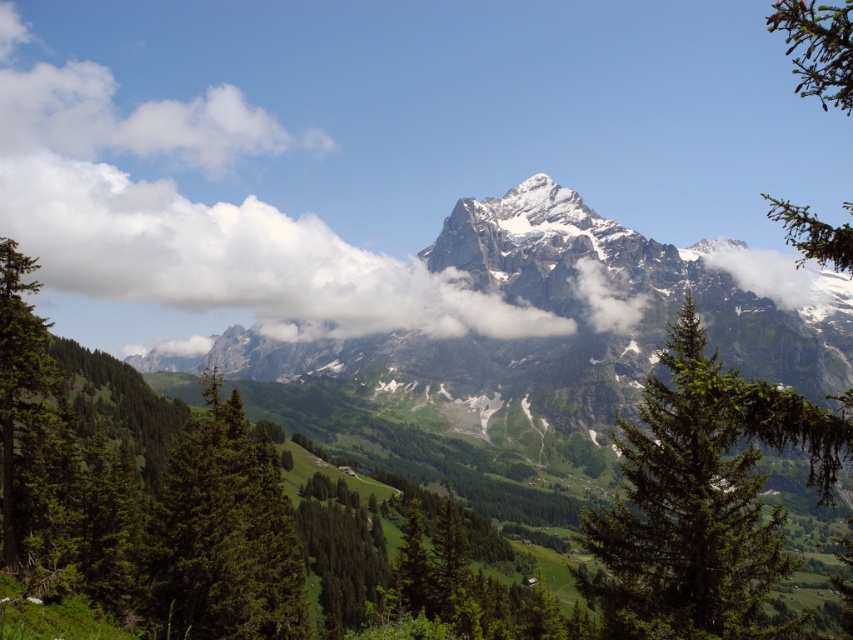
Which is more to the left, green needle-like branches at upper right or green textured tree at left?

green textured tree at left is more to the left.

Is point (848, 65) farther from camera compared to point (9, 525)?

No.

What do you see at coordinates (817, 48) in the screenshot? I see `green needle-like branches at upper right` at bounding box center [817, 48].

The height and width of the screenshot is (640, 853). In order to click on green needle-like branches at upper right in this screenshot , I will do `click(817, 48)`.

Between green matte tree at center-left and green needle-like branches at upper right, which one has more height?

green needle-like branches at upper right is taller.

Does green matte tree at center-left have a greater width compared to green needle-like branches at upper right?

Incorrect, green matte tree at center-left's width does not surpass green needle-like branches at upper right's.

Locate an element on the screen. The height and width of the screenshot is (640, 853). green matte tree at center-left is located at coordinates (223, 532).

Can you confirm if green matte tree at center-left is positioned to the left of green textured tree at left?

In fact, green matte tree at center-left is to the right of green textured tree at left.

Which is behind, point (218, 461) or point (9, 481)?

The point (218, 461) is behind.

You are a GUI agent. You are given a task and a screenshot of the screen. Output one action in this format:
    pyautogui.click(x=<x>, y=<y>)
    Task: Click on the green matte tree at center-left
    This screenshot has height=640, width=853.
    Given the screenshot: What is the action you would take?
    pyautogui.click(x=223, y=532)